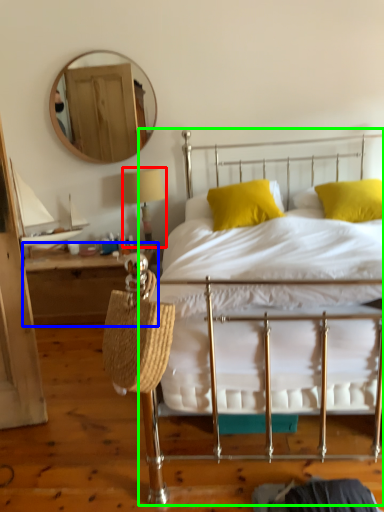
Question: Estimate the real-world distances between objects in this image. Which object is farther from table lamp (highlighted by a red box), nightstand (highlighted by a blue box) or bed (highlighted by a green box)?

Choices:
 (A) nightstand
 (B) bed

Answer: (B)